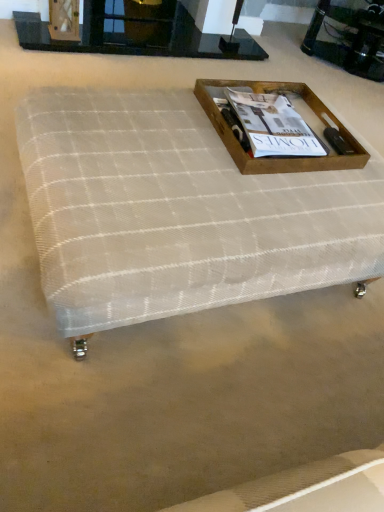
The width and height of the screenshot is (384, 512). Identify the location of vacant space in front of matte brown wooden tray at upper center. (254, 193).